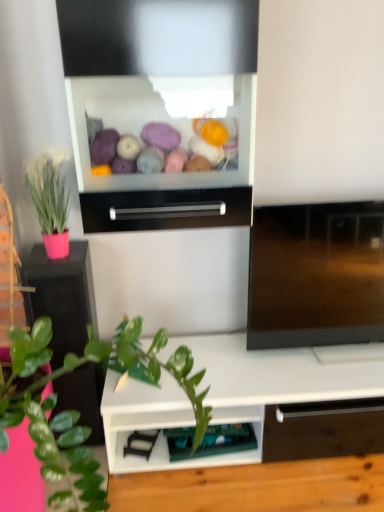
Locate an element on the screen. blank space situated above green plastic shelf at lower center (from a real-world perspective) is located at coordinates (208, 431).